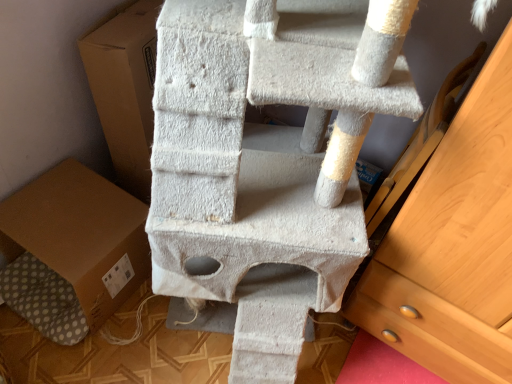
You are a GUI agent. You are given a task and a screenshot of the screen. Output one action in this format:
    pyautogui.click(x=<x>, y=<y>)
    Task: Click on the vacant area that lies to the right of brown cardboard box at lower left
    The height and width of the screenshot is (384, 512).
    Given the screenshot: What is the action you would take?
    pyautogui.click(x=165, y=333)